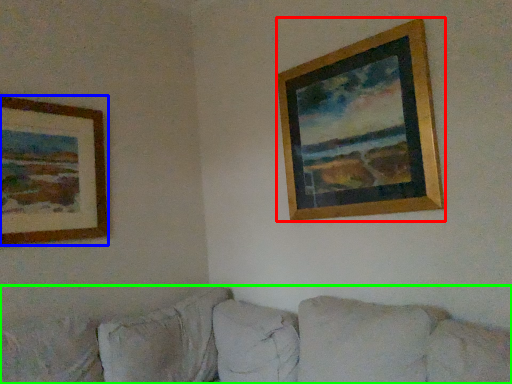
Question: Estimate the real-world distances between objects in this image. Which object is closer to picture frame (highlighted by a red box), picture frame (highlighted by a blue box) or studio couch (highlighted by a green box)?

Choices:
 (A) picture frame
 (B) studio couch

Answer: (B)